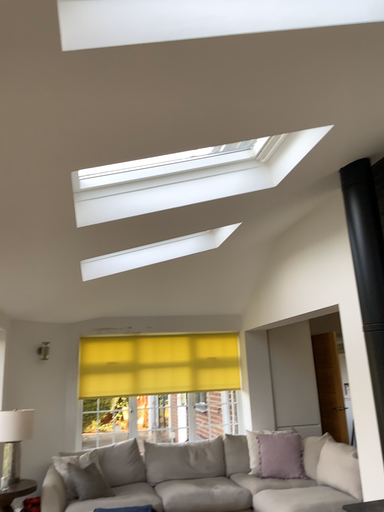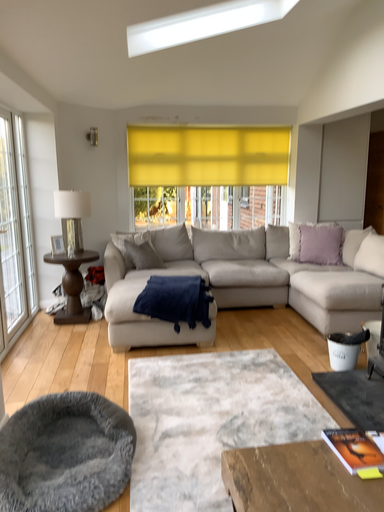
Question: How did the camera likely rotate when shooting the video?

Choices:
 (A) rotated upward
 (B) rotated downward

Answer: (B)